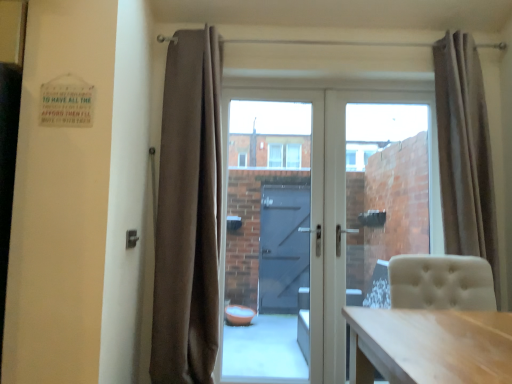
Where is `white glass door at center`? The height and width of the screenshot is (384, 512). white glass door at center is located at coordinates (319, 218).

The height and width of the screenshot is (384, 512). What do you see at coordinates (188, 213) in the screenshot? I see `brown velvet curtain at center, which ranks as the second curtain in right-to-left order` at bounding box center [188, 213].

How much space does brown velvet curtain at center, which ranks as the second curtain in right-to-left order, occupy vertically?

brown velvet curtain at center, which ranks as the second curtain in right-to-left order, is 2.07 meters in height.

You are a GUI agent. You are given a task and a screenshot of the screen. Output one action in this format:
    pyautogui.click(x=<x>, y=<y>)
    Task: Click on the white glass door at center
    Image resolution: width=512 pixels, height=384 pixels.
    Given the screenshot: What is the action you would take?
    pyautogui.click(x=319, y=218)

Can you tell me how much white glass door at center and brown velvet curtain at center, which is the 1th curtain in left-to-right order, differ in facing direction?

The angle between the facing direction of white glass door at center and the facing direction of brown velvet curtain at center, which is the 1th curtain in left-to-right order, is 0.982 degrees.

Which is correct: white glass door at center is inside brown velvet curtain at center, which ranks as the second curtain in right-to-left order, or outside of it?

white glass door at center exists outside the volume of brown velvet curtain at center, which ranks as the second curtain in right-to-left order.

Is white glass door at center far away from brown velvet curtain at center, which is the 1th curtain in left-to-right order?

white glass door at center is actually quite close to brown velvet curtain at center, which is the 1th curtain in left-to-right order.

From a real-world perspective, is white glass door at center physically below brown velvet curtain at center, which ranks as the second curtain in right-to-left order?

Correct, in the physical world, white glass door at center is lower than brown velvet curtain at center, which ranks as the second curtain in right-to-left order.

Identify the location of glass door that is on the right side of transparent glass door at center, marked as the first glass door in a left-to-right arrangement. The image size is (512, 384). tap(388, 187).

Considering the positions of point (401, 163) and point (295, 235), is point (401, 163) closer or farther from the camera than point (295, 235)?

Point (401, 163) is farther from the camera than point (295, 235).

Does transparent glass door at center, which is counted as the 2th glass door, starting from the left, lie in front of transparent glass door at center, marked as the first glass door in a left-to-right arrangement?

No, transparent glass door at center, which is counted as the 2th glass door, starting from the left, is behind transparent glass door at center, marked as the first glass door in a left-to-right arrangement.

Looking at this image, what's the angular difference between transparent glass door at center, which is counted as the 2th glass door, starting from the left, and transparent glass door at center, marked as the first glass door in a left-to-right arrangement,'s facing directions?

The facing directions of transparent glass door at center, which is counted as the 2th glass door, starting from the left, and transparent glass door at center, marked as the first glass door in a left-to-right arrangement, are 0.000108 degrees apart.

Is white glass door at center with beige fabric curtain at right, arranged as the 2th curtain when viewed from the left?

No, white glass door at center is not in contact with beige fabric curtain at right, arranged as the 2th curtain when viewed from the left.

From the picture: What's the angular difference between white glass door at center and beige fabric curtain at right, which is the first curtain from right to left,'s facing directions?

The facing directions of white glass door at center and beige fabric curtain at right, which is the first curtain from right to left, are 0.982 degrees apart.

From the image's perspective, relative to beige fabric curtain at right, which is the first curtain from right to left, is white glass door at center above or below?

From the image's perspective, white glass door at center appears below beige fabric curtain at right, which is the first curtain from right to left.

Is white glass door at center bigger or smaller than beige fabric curtain at right, which is the first curtain from right to left?

In the image, white glass door at center appears to be larger than beige fabric curtain at right, which is the first curtain from right to left.

Is white glass door at center oriented towards transparent glass door at center, marked as the first glass door in a left-to-right arrangement?

Yes, white glass door at center is aimed at transparent glass door at center, marked as the first glass door in a left-to-right arrangement.

How far apart are white glass door at center and transparent glass door at center, marked as the first glass door in a left-to-right arrangement?

They are 15.87 inches apart.

Does white glass door at center appear on the left side of transparent glass door at center, the second glass door when ordered from right to left?

In fact, white glass door at center is to the right of transparent glass door at center, the second glass door when ordered from right to left.

Is white glass door at center surrounding transparent glass door at center, marked as the first glass door in a left-to-right arrangement?

Yes, transparent glass door at center, marked as the first glass door in a left-to-right arrangement, can be found within white glass door at center.

From the image's perspective, would you say transparent glass door at center, the 1th glass door in the right-to-left sequence, is positioned over beige fabric curtain at right, arranged as the 2th curtain when viewed from the left?

No, from the image's perspective, transparent glass door at center, the 1th glass door in the right-to-left sequence, is not on top of beige fabric curtain at right, arranged as the 2th curtain when viewed from the left.

Starting from the beige fabric curtain at right, arranged as the 2th curtain when viewed from the left, which glass door is the 1st one to the left? Please provide its 2D coordinates.

[(388, 187)]

Between transparent glass door at center, which is counted as the 2th glass door, starting from the left, and beige fabric curtain at right, which is the first curtain from right to left, which one is positioned in front?

beige fabric curtain at right, which is the first curtain from right to left, is in front.

Is transparent glass door at center, which is counted as the 2th glass door, starting from the left, inside white glass door at center?

Yes, white glass door at center is surrounding transparent glass door at center, which is counted as the 2th glass door, starting from the left.

Are white glass door at center and transparent glass door at center, which is counted as the 2th glass door, starting from the left, beside each other?

white glass door at center and transparent glass door at center, which is counted as the 2th glass door, starting from the left, are not in contact.

Does white glass door at center appear on the left side of transparent glass door at center, the 1th glass door in the right-to-left sequence?

Correct, you'll find white glass door at center to the left of transparent glass door at center, the 1th glass door in the right-to-left sequence.

Is the position of white glass door at center less distant than that of transparent glass door at center, the 1th glass door in the right-to-left sequence?

No.

Is beige fabric curtain at right, arranged as the 2th curtain when viewed from the left, in front of or behind transparent glass door at center, the second glass door when ordered from right to left, in the image?

beige fabric curtain at right, arranged as the 2th curtain when viewed from the left, is positioned closer to the viewer than transparent glass door at center, the second glass door when ordered from right to left.

From a real-world perspective, is beige fabric curtain at right, arranged as the 2th curtain when viewed from the left, physically located above or below transparent glass door at center, marked as the first glass door in a left-to-right arrangement?

beige fabric curtain at right, arranged as the 2th curtain when viewed from the left, is situated higher than transparent glass door at center, marked as the first glass door in a left-to-right arrangement, in the real world.

Is beige fabric curtain at right, arranged as the 2th curtain when viewed from the left, positioned far away from transparent glass door at center, the second glass door when ordered from right to left?

No, beige fabric curtain at right, arranged as the 2th curtain when viewed from the left, is not far from transparent glass door at center, the second glass door when ordered from right to left.

Is beige fabric curtain at right, arranged as the 2th curtain when viewed from the left, situated inside transparent glass door at center, marked as the first glass door in a left-to-right arrangement, or outside?

The correct answer is: outside.

You are a GUI agent. You are given a task and a screenshot of the screen. Output one action in this format:
    pyautogui.click(x=<x>, y=<y>)
    Task: Click on the door lying below the brown velvet curtain at center, which is the 1th curtain in left-to-right order (from the image's perspective)
    The width and height of the screenshot is (512, 384).
    Given the screenshot: What is the action you would take?
    pyautogui.click(x=319, y=218)

Find the location of a particular element. glass door lying on the right of transparent glass door at center, marked as the first glass door in a left-to-right arrangement is located at coordinates (388, 187).

Considering their positions, is transparent glass door at center, the 1th glass door in the right-to-left sequence, positioned closer to brown velvet curtain at center, which ranks as the second curtain in right-to-left order, than transparent glass door at center, the second glass door when ordered from right to left?

Among the two, transparent glass door at center, the second glass door when ordered from right to left, is located nearer to brown velvet curtain at center, which ranks as the second curtain in right-to-left order.

Considering their positions, is transparent glass door at center, marked as the first glass door in a left-to-right arrangement, positioned further to white glass door at center than transparent glass door at center, the 1th glass door in the right-to-left sequence?

transparent glass door at center, marked as the first glass door in a left-to-right arrangement, is positioned further to the anchor white glass door at center.

When comparing their distances from transparent glass door at center, the 1th glass door in the right-to-left sequence, does beige fabric curtain at right, which is the first curtain from right to left, or transparent glass door at center, the second glass door when ordered from right to left, seem further?

transparent glass door at center, the second glass door when ordered from right to left, is positioned further to the anchor transparent glass door at center, the 1th glass door in the right-to-left sequence.

Looking at the image, which one is located closer to transparent glass door at center, the 1th glass door in the right-to-left sequence, white glass door at center or beige fabric curtain at right, arranged as the 2th curtain when viewed from the left?

white glass door at center is closer to transparent glass door at center, the 1th glass door in the right-to-left sequence.

When comparing their distances from white glass door at center, does brown velvet curtain at center, which ranks as the second curtain in right-to-left order, or transparent glass door at center, the 1th glass door in the right-to-left sequence, seem closer?

Among the two, transparent glass door at center, the 1th glass door in the right-to-left sequence, is located nearer to white glass door at center.

From the image, which object appears to be farther from beige fabric curtain at right, arranged as the 2th curtain when viewed from the left, white glass door at center or transparent glass door at center, marked as the first glass door in a left-to-right arrangement?

Among the two, transparent glass door at center, marked as the first glass door in a left-to-right arrangement, is located further to beige fabric curtain at right, arranged as the 2th curtain when viewed from the left.

When comparing their distances from transparent glass door at center, marked as the first glass door in a left-to-right arrangement, does brown velvet curtain at center, which ranks as the second curtain in right-to-left order, or beige fabric curtain at right, which is the first curtain from right to left, seem closer?

Based on the image, brown velvet curtain at center, which ranks as the second curtain in right-to-left order, appears to be nearer to transparent glass door at center, marked as the first glass door in a left-to-right arrangement.

Based on their spatial positions, is transparent glass door at center, which is counted as the 2th glass door, starting from the left, or transparent glass door at center, the second glass door when ordered from right to left, closer to white glass door at center?

The object closer to white glass door at center is transparent glass door at center, which is counted as the 2th glass door, starting from the left.

The width and height of the screenshot is (512, 384). Identify the location of glass door between white glass door at center and beige fabric curtain at right, which is the first curtain from right to left, from left to right. (388, 187).

You are a GUI agent. You are given a task and a screenshot of the screen. Output one action in this format:
    pyautogui.click(x=<x>, y=<y>)
    Task: Click on the door between brown velvet curtain at center, which ranks as the second curtain in right-to-left order, and transparent glass door at center, the 1th glass door in the right-to-left sequence, from left to right
    The width and height of the screenshot is (512, 384).
    Given the screenshot: What is the action you would take?
    pyautogui.click(x=319, y=218)

Image resolution: width=512 pixels, height=384 pixels. In order to click on door between brown velvet curtain at center, which is the 1th curtain in left-to-right order, and beige fabric curtain at right, arranged as the 2th curtain when viewed from the left, in the horizontal direction in this screenshot , I will do `click(319, 218)`.

The height and width of the screenshot is (384, 512). In order to click on door situated between transparent glass door at center, marked as the first glass door in a left-to-right arrangement, and beige fabric curtain at right, which is the first curtain from right to left, from left to right in this screenshot , I will do `click(319, 218)`.